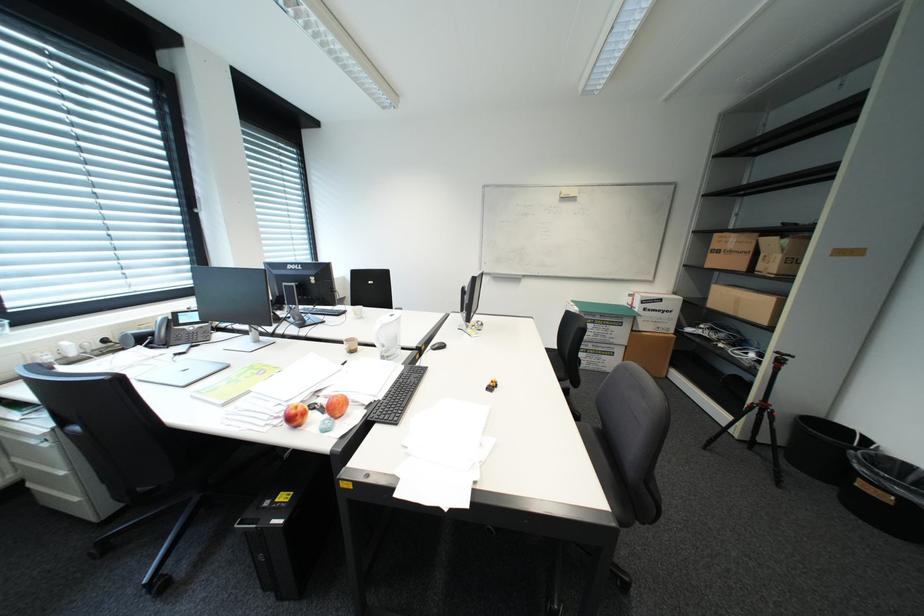
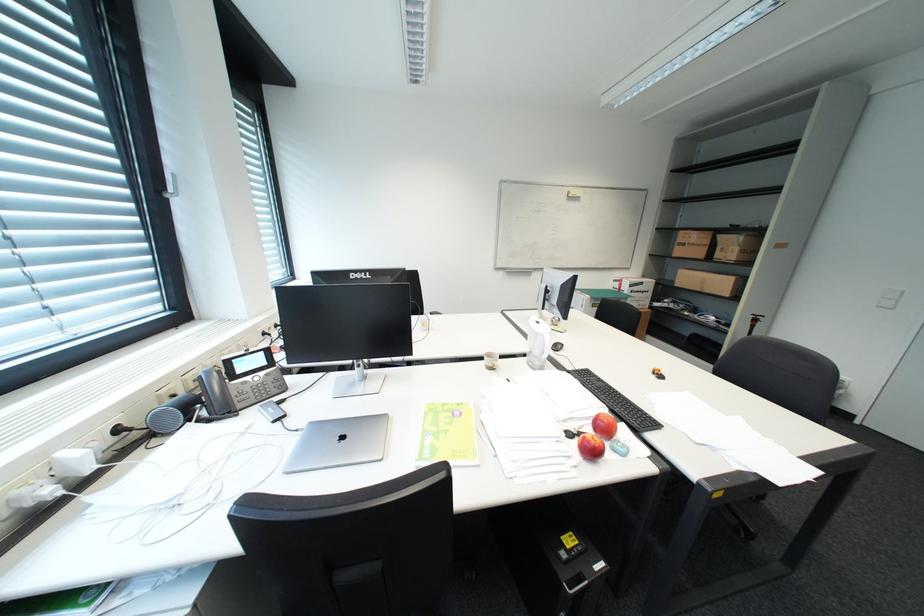
Question: What movement of the cameraman would produce the second image?

Choices:
 (A) Left
 (B) Right
 (C) Forward
 (D) Backward

Answer: (A)